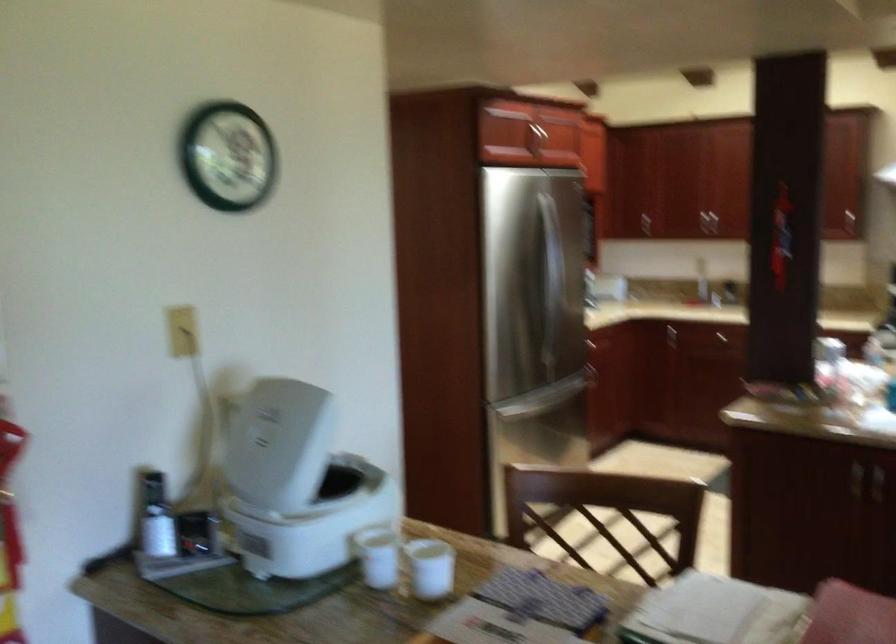
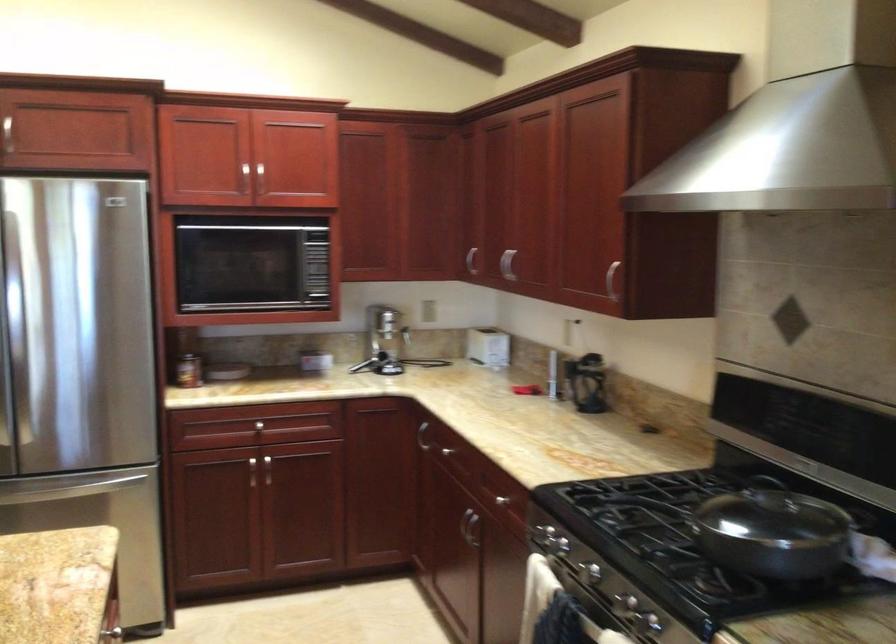
Find the pixel in the second image that matches (616,205) in the first image.

(471, 261)